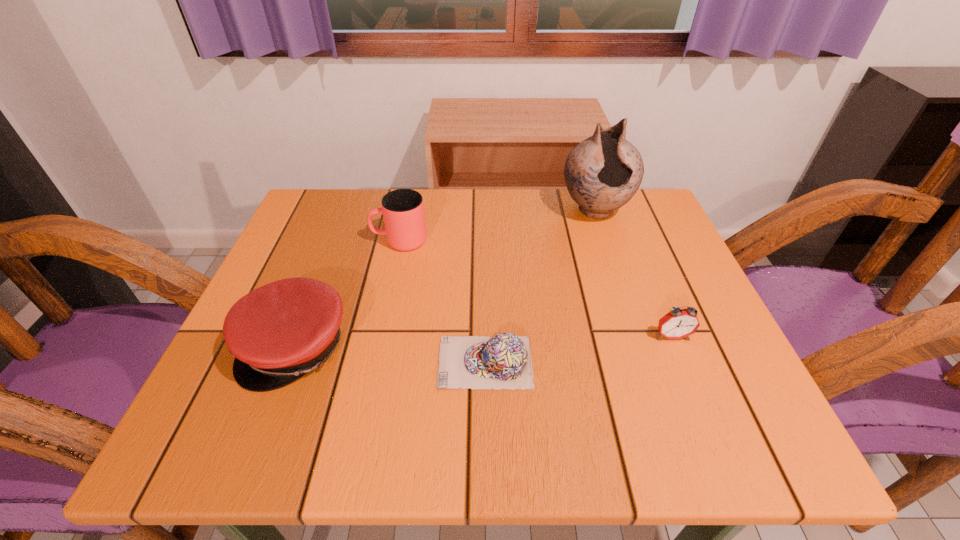
Find the location of a particular element. vacant area that satisfies the following two spatial constraints: 1. from the spout of the tallest object; 2. on the front, side, and top of the shorter cap is located at coordinates (646, 362).

The height and width of the screenshot is (540, 960). I want to click on vacant region that satisfies the following two spatial constraints: 1. from the spout of the tallest object; 2. on the front, side, and top of the shorter cap, so click(x=646, y=362).